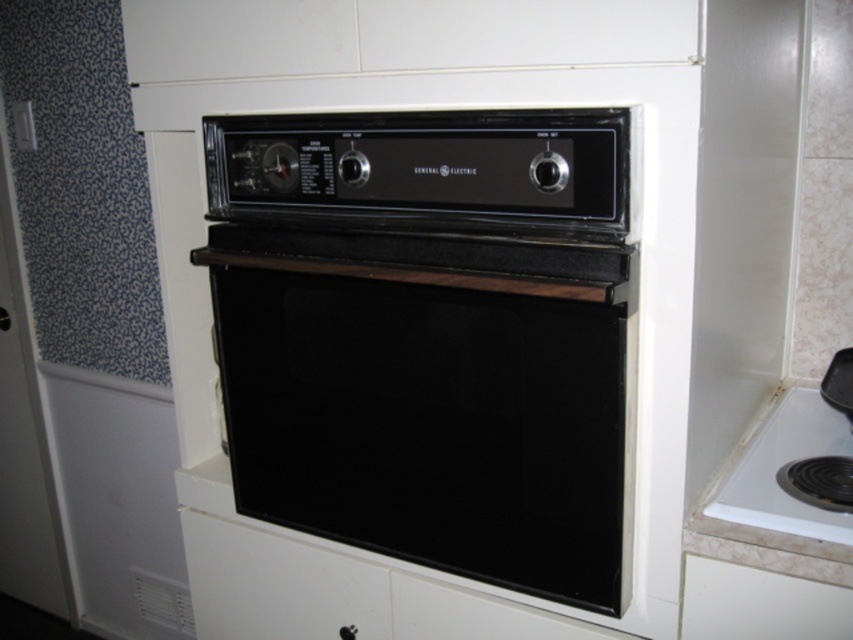
Question: Which object appears closest to the camera in this image?

Choices:
 (A) white glossy cooktop at lower right
 (B) black glass oven at center

Answer: (B)

Question: Which object appears closest to the camera in this image?

Choices:
 (A) black glass oven at center
 (B) white glossy cooktop at lower right

Answer: (A)

Question: Does black glass oven at center appear over white glossy cooktop at lower right?

Choices:
 (A) no
 (B) yes

Answer: (B)

Question: Is black glass oven at center closer to the viewer compared to white glossy cooktop at lower right?

Choices:
 (A) yes
 (B) no

Answer: (A)

Question: Which point is closer to the camera?

Choices:
 (A) white glossy cooktop at lower right
 (B) black glass oven at center

Answer: (B)

Question: Does black glass oven at center have a larger size compared to white glossy cooktop at lower right?

Choices:
 (A) no
 (B) yes

Answer: (B)